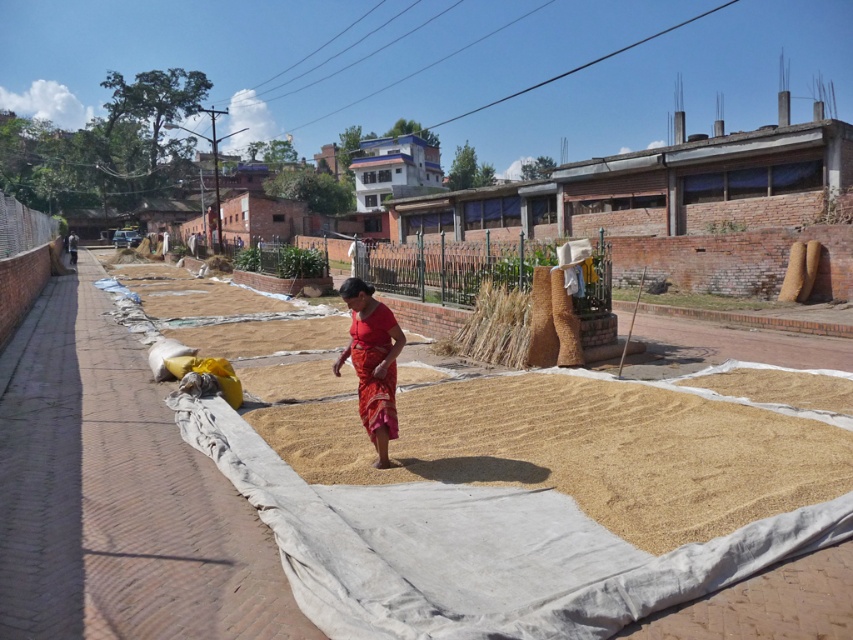
You are standing in the middle of the white tarpaulin and see two points marked on the ground. Which point is closer to you, point (619, 422) or point (364, 301)?

Point (364, 301) is closer to you because it is less further away than point (619, 422).

You are a farmer who wants to separate the brown grain at center from the brown straw at center. According to the scene, which one is located to the right side?

The brown grain at center is positioned on the right side of brown straw at center.